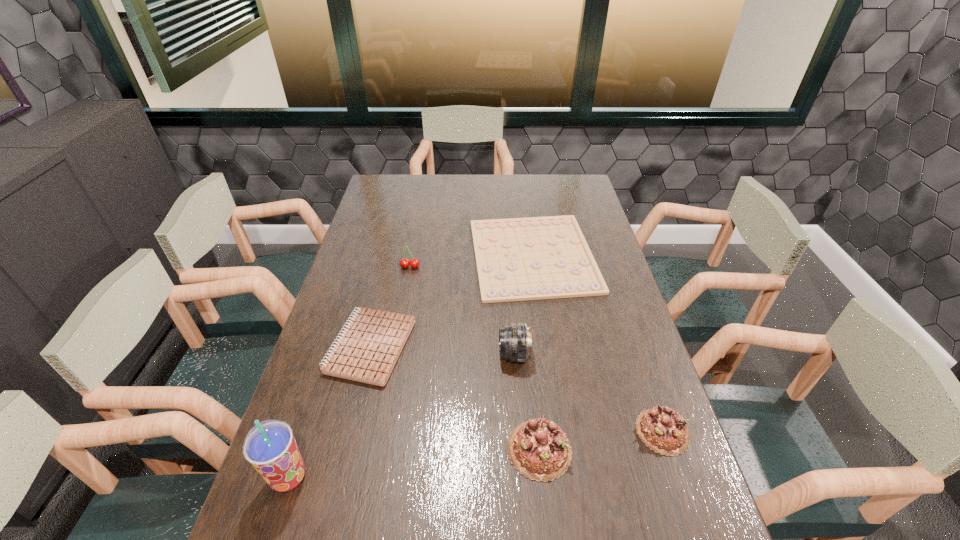
At what (x,y) coordinates should I click in order to perform the action: click on free space in the image that satisfies the following two spatial constraints: 1. at the front element of the telephoto lens; 2. on the back side of the left chocolate cake. Please return your answer as a coordinate pair (x, y). Image resolution: width=960 pixels, height=540 pixels. Looking at the image, I should click on (521, 450).

I want to click on free space that satisfies the following two spatial constraints: 1. on the front side of the second shortest object; 2. on the left side of the left chocolate cake, so click(345, 450).

The width and height of the screenshot is (960, 540). Find the location of `free space that satisfies the following two spatial constraints: 1. on the back side of the shortest object; 2. on the right side of the fourth shortest object`. free space that satisfies the following two spatial constraints: 1. on the back side of the shortest object; 2. on the right side of the fourth shortest object is located at coordinates (518, 255).

Locate an element on the screen. vacant region that satisfies the following two spatial constraints: 1. at the front element of the fifth tallest object; 2. on the left side of the sixth shortest object is located at coordinates [520, 431].